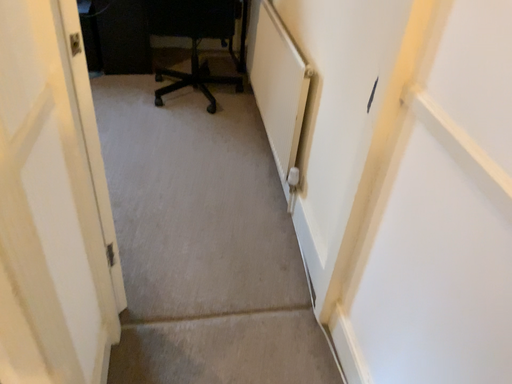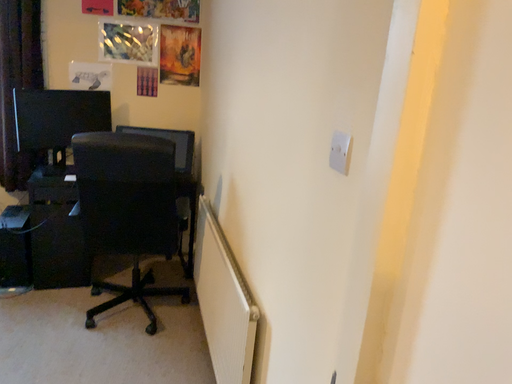
Question: How did the camera likely rotate when shooting the video?

Choices:
 (A) rotated upward
 (B) rotated downward

Answer: (A)